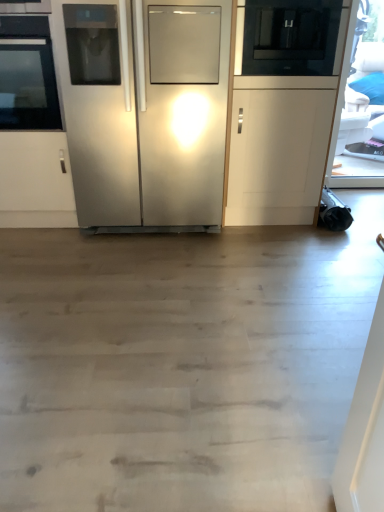
Question: Considering the positions of black glass microwave at upper right and black glass oven at left in the image, is black glass microwave at upper right taller or shorter than black glass oven at left?

Choices:
 (A) short
 (B) tall

Answer: (A)

Question: Is black glass microwave at upper right to the left or to the right of black glass oven at left in the image?

Choices:
 (A) right
 (B) left

Answer: (A)

Question: Which object is positioned farthest from the black glass oven at left?

Choices:
 (A) stainless steel refrigerator at center
 (B) black glass microwave at upper right

Answer: (B)

Question: Which of these objects is positioned closest to the black glass oven at left?

Choices:
 (A) black glass microwave at upper right
 (B) stainless steel refrigerator at center

Answer: (B)